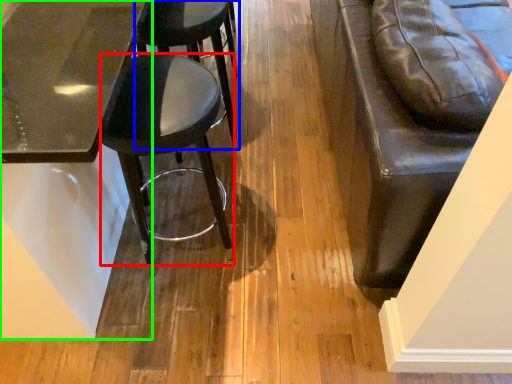
Question: Which is farther away from stool (highlighted by a red box)? stool (highlighted by a blue box) or table (highlighted by a green box)?

Choices:
 (A) stool
 (B) table

Answer: (A)